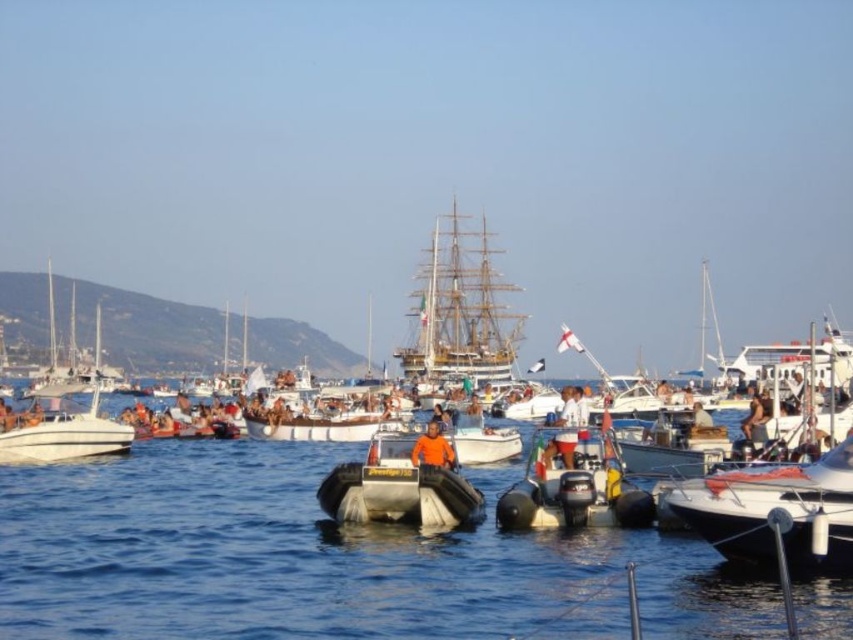
You are a photographer standing at the edge of the marina trying to capture a clear shot of the silver metallic dinghy at center and the brown leather jacket at center. Which object should you focus on first if you want to avoid having to adjust your camera focus significantly?

The silver metallic dinghy at center is much taller than the brown leather jacket at center, so focusing on the taller object first would allow you to capture both without major focus adjustments.

You are standing at the edge of the marina looking out at the boats. There are two points marked on the water surface. The first point is at coordinates point (x=341, y=515) and the second is at point (x=10, y=449). If you were to throw a floating ring into the water, which point would it reach first if it floats towards the direction of the large sailing ship?

The floating ring would reach point (x=341, y=515) first because it is in front of point (x=10, y=449) in the direction of the large sailing ship.

Based on the photo, you are standing at the point with coordinates point (x=764, y=433) and want to move to the point with coordinates point (x=129, y=429). According to the scene, will you be moving towards the foreground or the background?

Point (x=129, y=429) is behind point (x=764, y=433), so moving from point (x=764, y=433) to point (x=129, y=429) means you are moving towards the background.